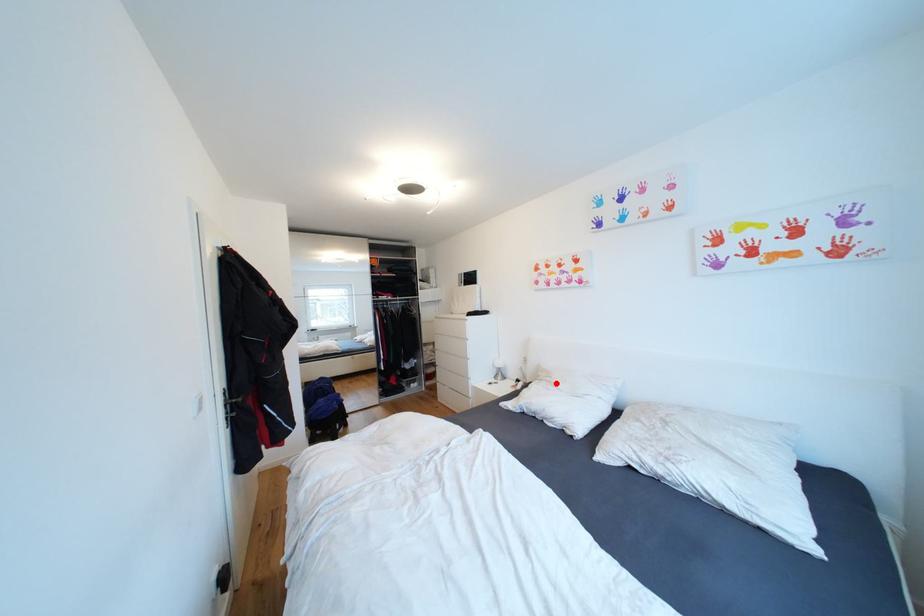
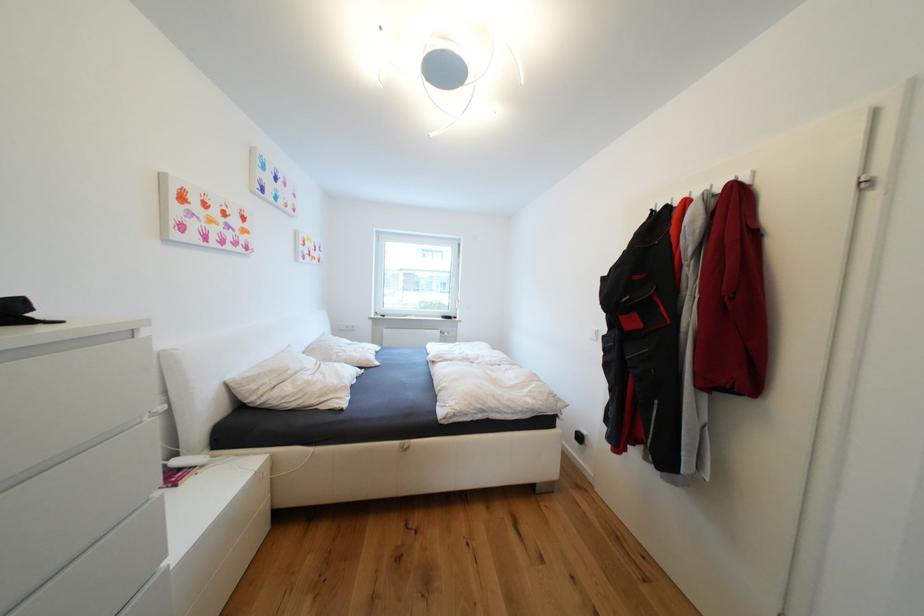
Locate, in the second image, the point that corresponds to the highlighted location in the first image.

(304, 374)